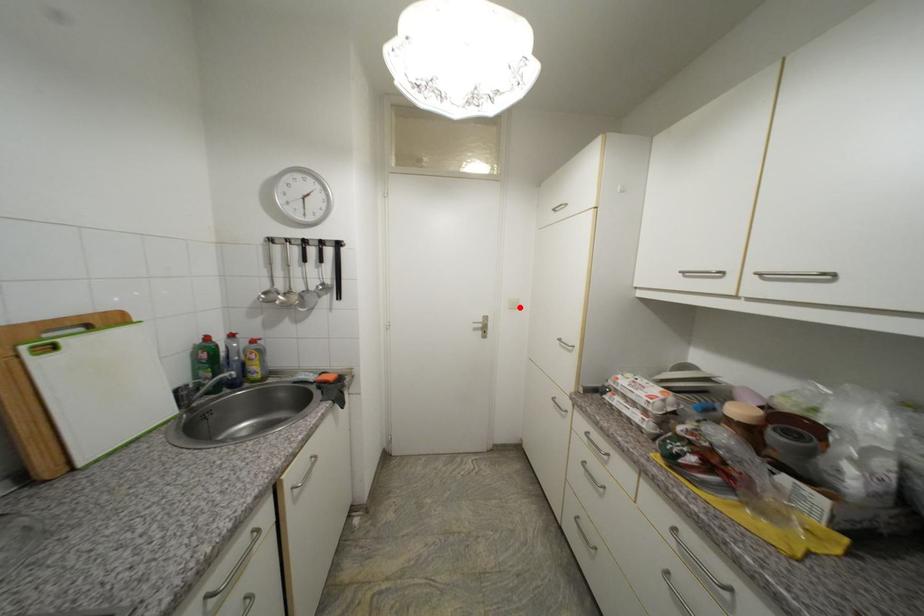
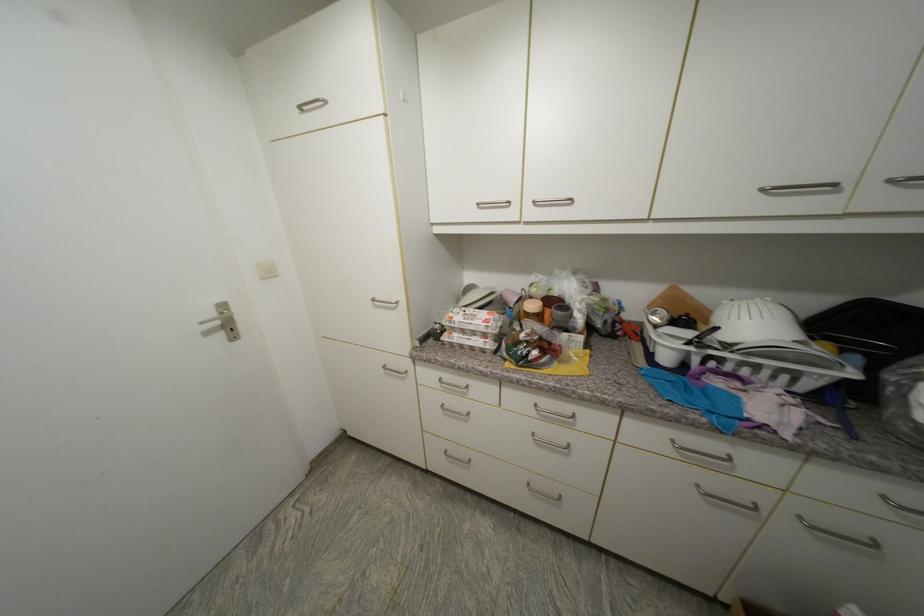
Find the pixel in the second image that matches the highlighted location in the first image.

(274, 275)